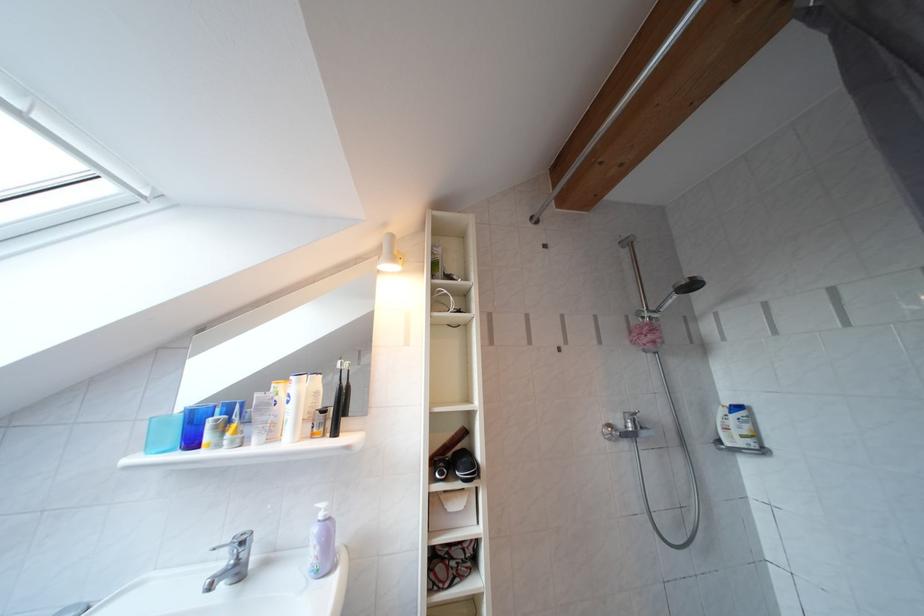
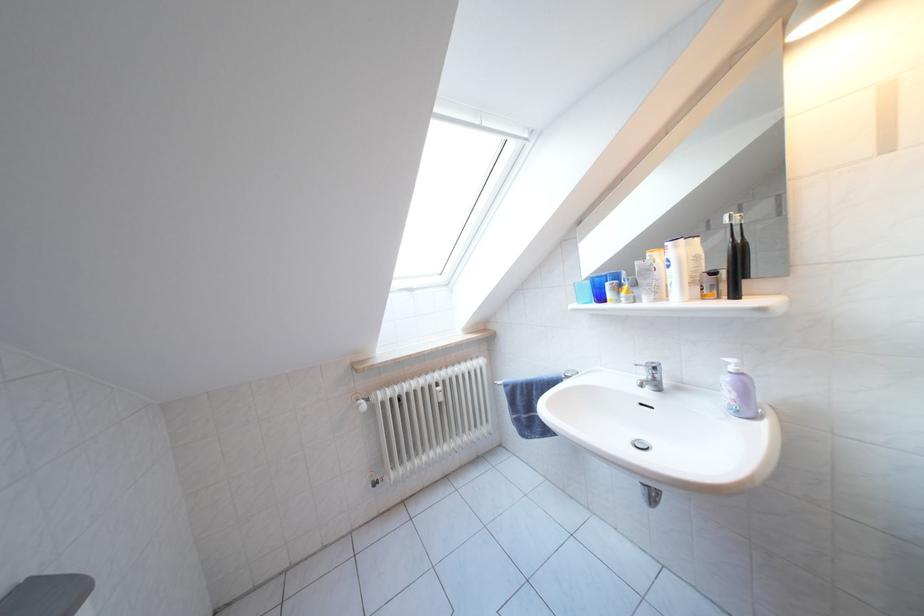
Question: The camera is either moving clockwise (left) or counter-clockwise (right) around the object. The first image is from the beginning of the video and the second image is from the end. Is the camera moving left or right when shooting the video?

Choices:
 (A) Left
 (B) Right

Answer: (B)